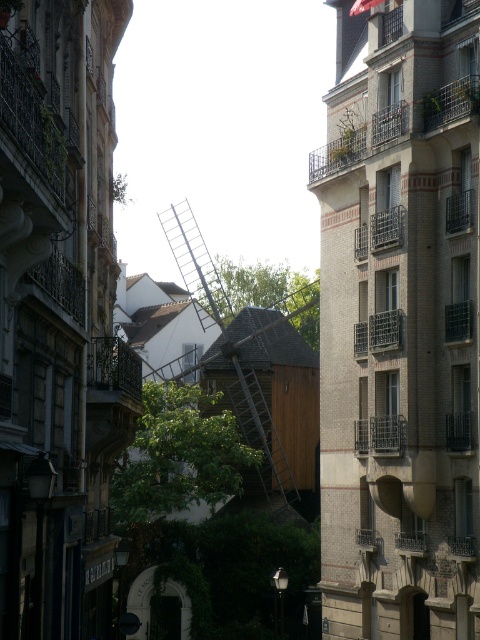
You are a tourist standing in the middle of the narrow street and want to take a photo of both the white brick building at center and the wooden ladder at center. Which object should you focus on first to ensure both are in frame?

You should focus on the white brick building at center first because it is closer to you than the wooden ladder at center, so adjusting the camera to include it will also capture the ladder in the background.

You are a tourist in the city and want to take a photo of the wooden ladder at center without any buildings blocking it. Is the white brick building at center in the way?

The white brick building at center is positioned on the right side of wooden ladder at center, so it is not blocking the ladder. You can take a photo of the wooden ladder at center without the white brick building at center obstructing the view.

You are standing in the middle of the narrow street looking towards the windmill. There are two points marked on the buildings in front of you. The first point is at coordinates point (322, 564) and the second is at point (202, 300). Which point is closer to your current position?

Point (322, 564) is closer to the camera than point (202, 300), so the first point is closer to your current position.